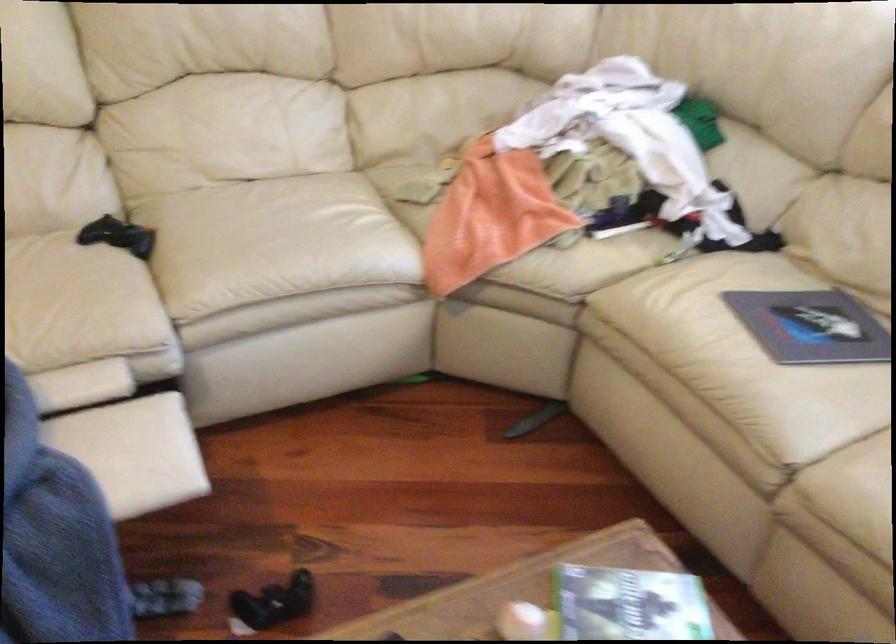
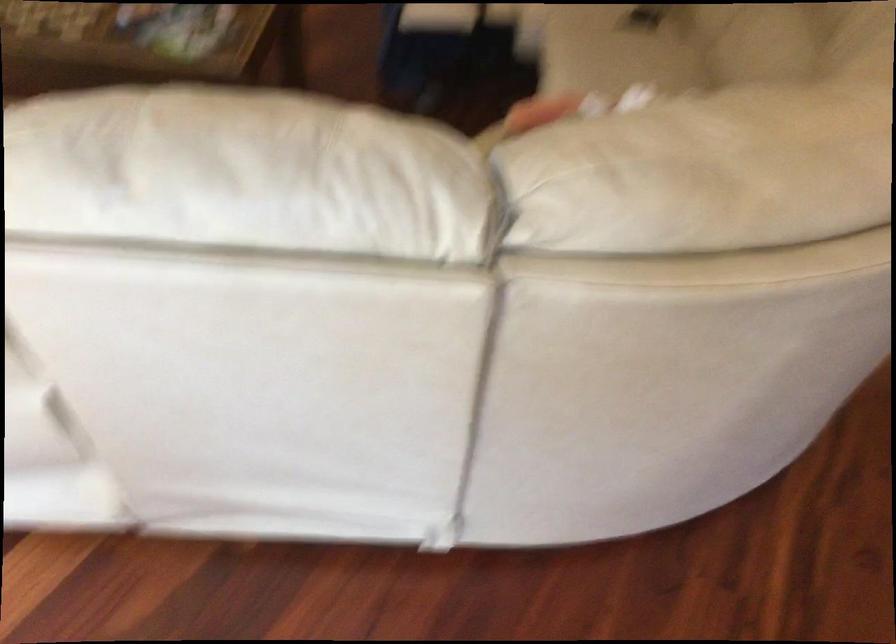
Find the pixel in the second image that matches the point at 195,442 in the first image.

(437, 17)